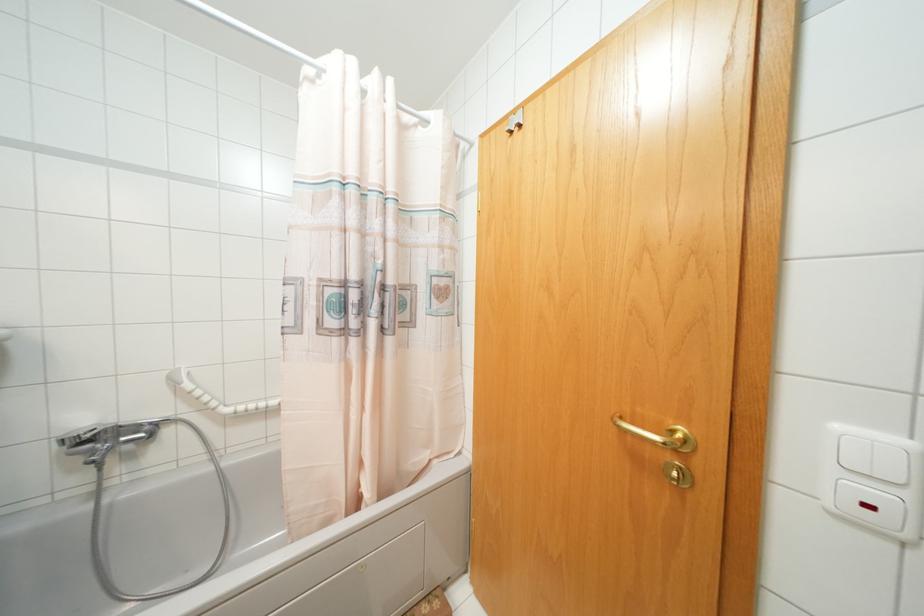
I want to click on door lock, so click(515, 121).